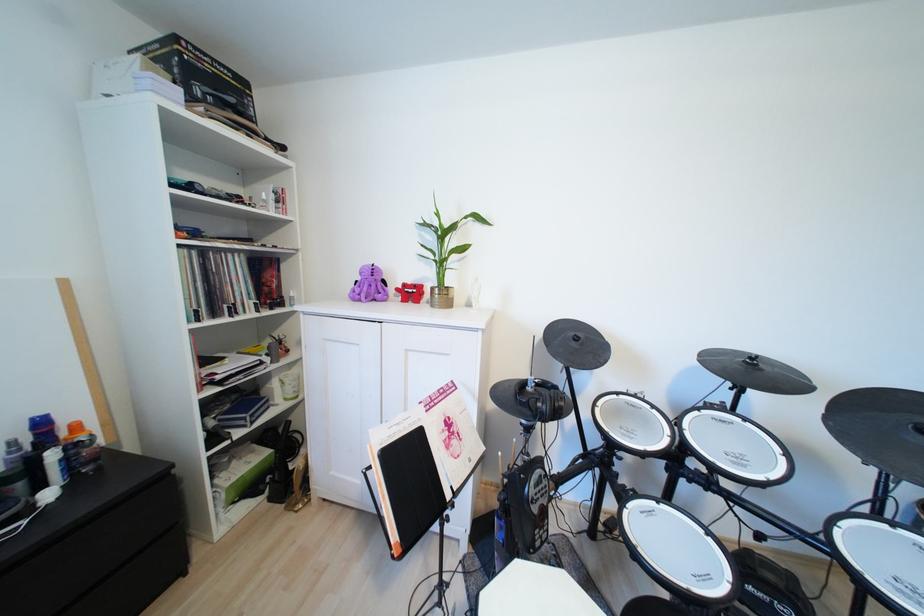
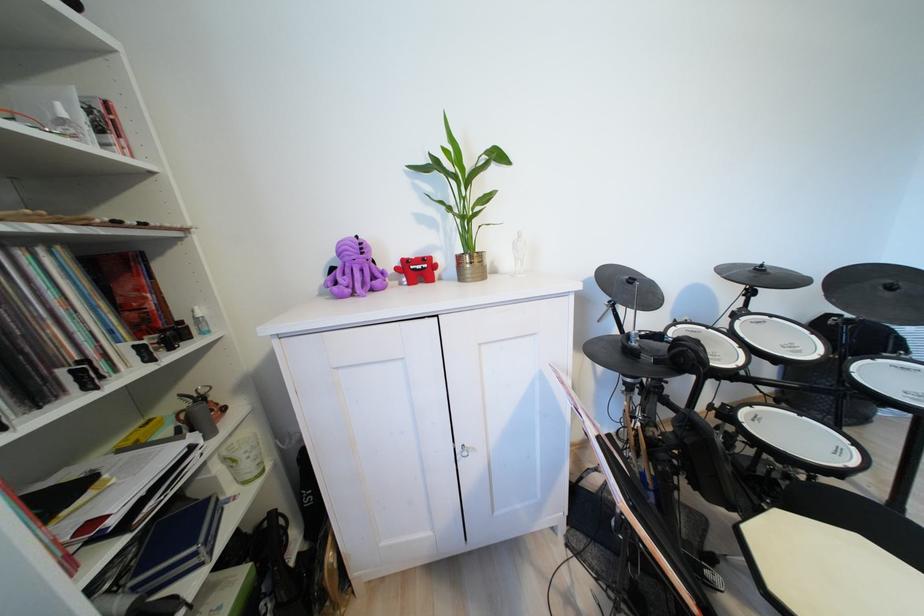
Where in the second image is the point corresponding to point (411, 286) from the first image?

(411, 262)